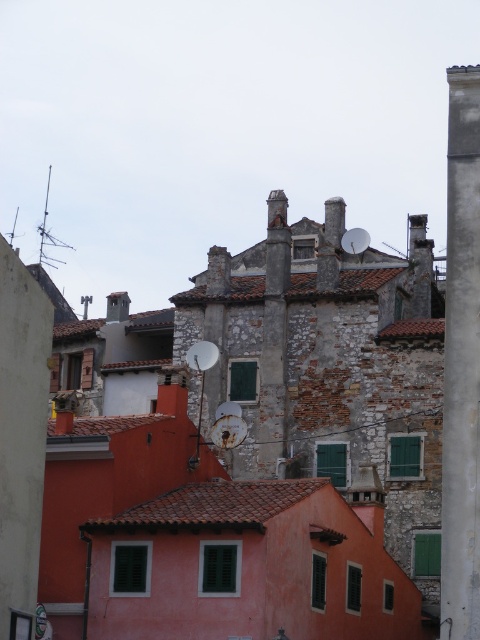
You are a city planner assessing the space between the smooth concrete pillar at right and the metallic street sign at lower left. If you want to install a rectangular bench that is 1.2 meters wide, will there be enough space between them?

The smooth concrete pillar at right is wider than the metallic street sign at lower left. However, the exact distance between them isn not provided in the description, so it is uncertain if the 1.2 meter bench will fit. More information about the spacing between the two objects is needed to determine feasibility.

In the scene shown: You are a tourist standing in the historic urban area and want to take a photo of the smooth concrete pillar at right and the metallic street sign at lower left. Which object should you focus on first to ensure both are in the frame?

You should focus on the smooth concrete pillar at right first since it is in front of the metallic street sign at lower left, allowing both to be captured in the frame when positioned correctly.

You are a tourist standing in front of the pink building with terracotta roofs. You see a smooth concrete pillar at right and a metallic street sign at lower left. Which object is positioned to the right of the other?

The smooth concrete pillar at right is positioned to the right of the metallic street sign at lower left.